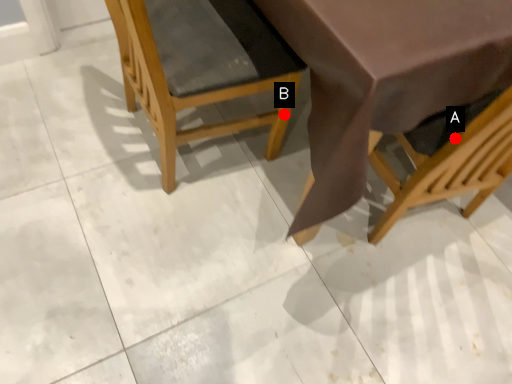
Question: Two points are circled on the image, labeled by A and B beside each circle. Which of the following is the farthest from the observer?

Choices:
 (A) A is further
 (B) B is further

Answer: (B)